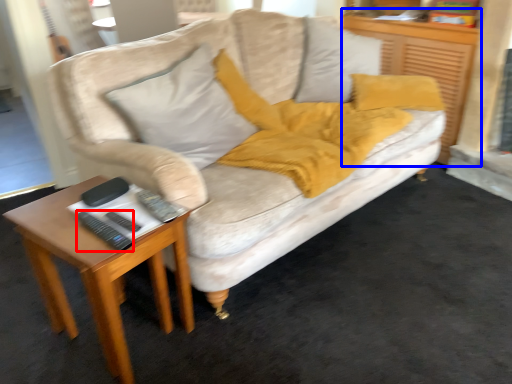
Question: Which object appears farthest to the camera in this image, remote (highlighted by a red box) or dresser (highlighted by a blue box)?

Choices:
 (A) remote
 (B) dresser

Answer: (B)